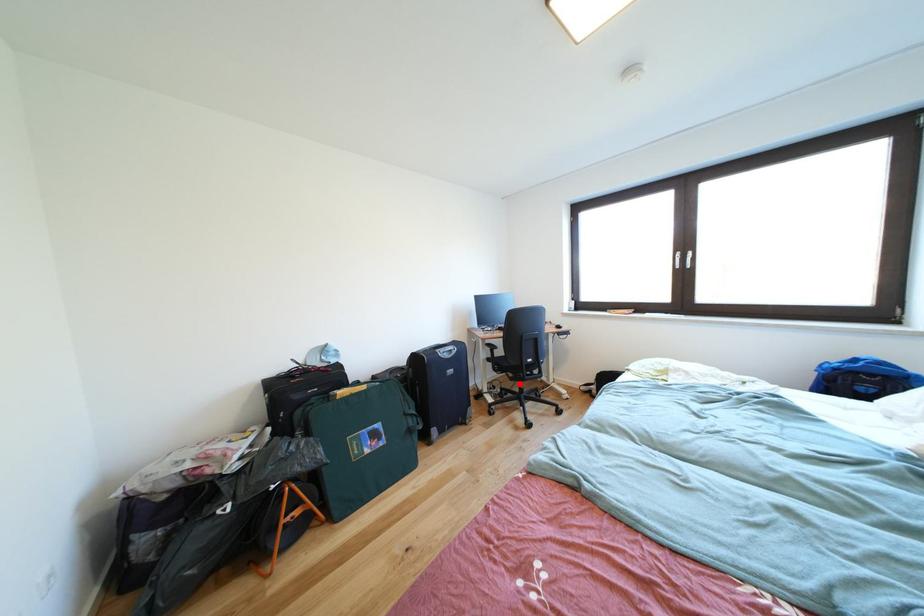
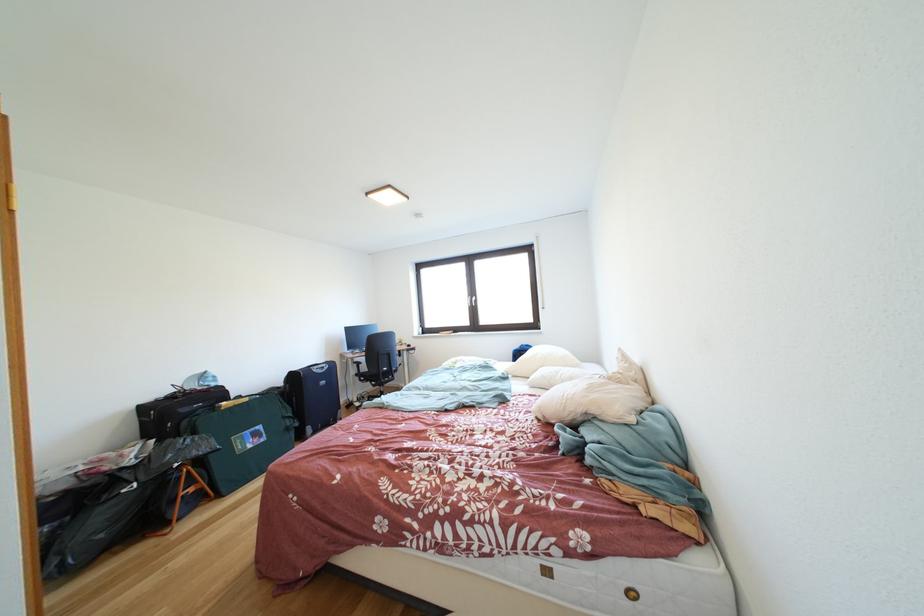
Find the pixel in the second image that matches the highlighted location in the first image.

(383, 391)